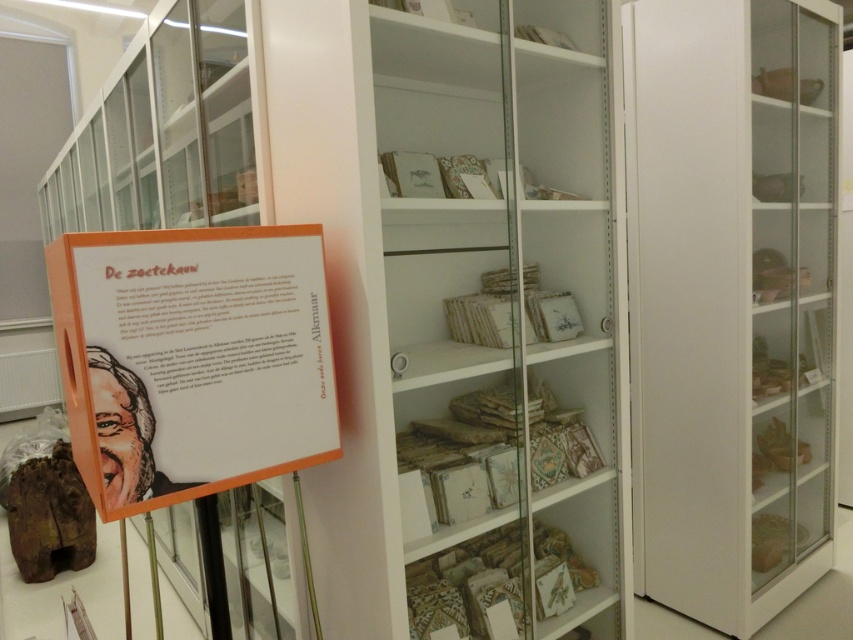
Question: Which is nearer to the white glossy bookshelf at center?

Choices:
 (A) matte white bookshelf at center
 (B) white glossy cabinet at right
 (C) orange paper poster at center

Answer: (C)

Question: Which object is farther from the camera taking this photo?

Choices:
 (A) white glossy bookshelf at center
 (B) white glossy cabinet at right
 (C) matte white bookshelf at center
 (D) orange paper poster at center

Answer: (B)

Question: Can you confirm if white glossy cabinet at right is positioned above white glossy bookshelf at center?

Choices:
 (A) yes
 (B) no

Answer: (B)

Question: Is white glossy cabinet at right below orange paper poster at center?

Choices:
 (A) no
 (B) yes

Answer: (A)

Question: Can you confirm if matte white bookshelf at center is bigger than orange paper poster at center?

Choices:
 (A) no
 (B) yes

Answer: (B)

Question: Considering the real-world distances, which object is closest to the matte white bookshelf at center?

Choices:
 (A) orange paper poster at center
 (B) white glossy bookshelf at center

Answer: (A)